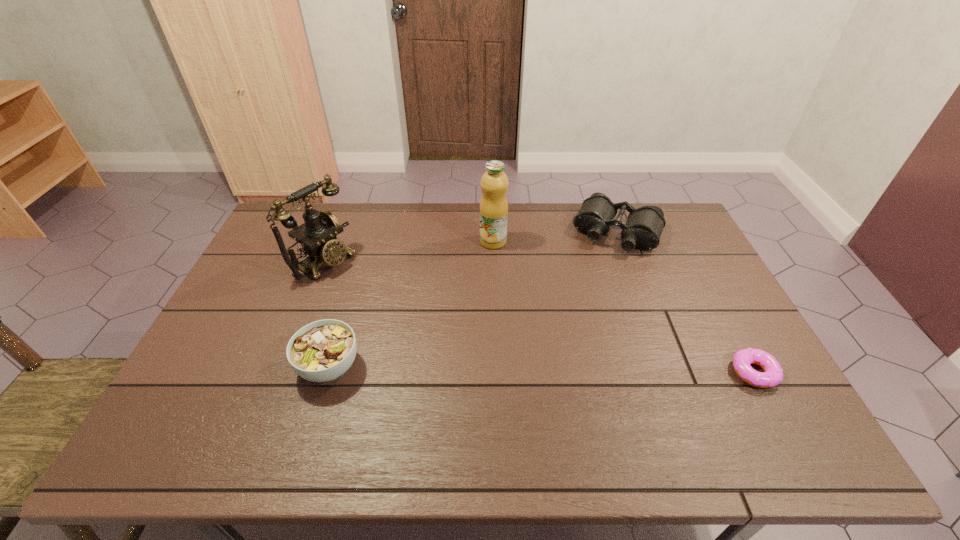
You are a GUI agent. You are given a task and a screenshot of the screen. Output one action in this format:
    pyautogui.click(x=<x>, y=<y>)
    Task: Click on the unoccupied area between the third object from right to left and the telephone
    The width and height of the screenshot is (960, 540).
    Given the screenshot: What is the action you would take?
    pyautogui.click(x=409, y=251)

Identify which object is the second nearest to the telephone. Please provide its 2D coordinates. Your answer should be formatted as a tuple, i.e. [(x, y)], where the tuple contains the x and y coordinates of a point satisfying the conditions above.

[(494, 183)]

Select which object appears as the second closest to the soup bowl. Please provide its 2D coordinates. Your answer should be formatted as a tuple, i.e. [(x, y)], where the tuple contains the x and y coordinates of a point satisfying the conditions above.

[(494, 183)]

The image size is (960, 540). What are the coordinates of `free point that satisfies the following two spatial constraints: 1. on the front side of the binoculars; 2. on the left side of the doughnut` in the screenshot? It's located at (669, 373).

Locate an element on the screen. Image resolution: width=960 pixels, height=540 pixels. free space in the image that satisfies the following two spatial constraints: 1. on the front side of the shortest object; 2. on the left side of the telephone is located at coordinates (281, 373).

Locate an element on the screen. free spot that satisfies the following two spatial constraints: 1. on the front side of the telephone; 2. on the left side of the doughnut is located at coordinates (281, 373).

Where is `blank space that satisfies the following two spatial constraints: 1. on the front side of the third object from right to left; 2. on the left side of the shortest object`? blank space that satisfies the following two spatial constraints: 1. on the front side of the third object from right to left; 2. on the left side of the shortest object is located at coordinates point(497,373).